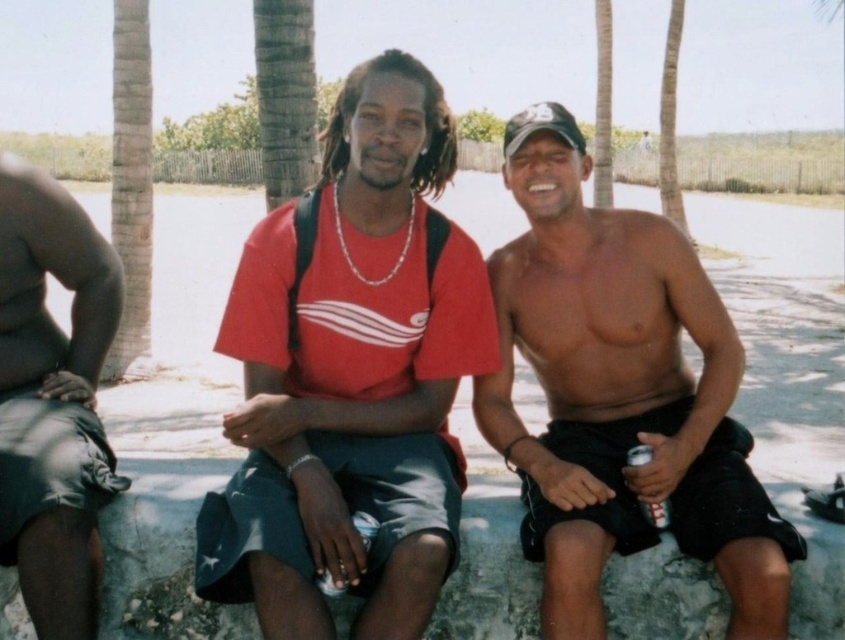
Consider the image. You are designing a digital collage and need to place a sticker exactly where the red matte shirt at center is located. According to the coordinates provided, what are the X and Y values you should use for the sticker placement?

The X value is 0.591 and the Y value is 0.417.

You are a photographer trying to capture the perfect shot of the shiny black shorts at center. According to the coordinates provided, where exactly should you position your camera to ensure the shorts are centered in your frame?

The shiny black shorts at center are located at coordinates point (620, 396), so you should position your camera to center the frame at those coordinates to capture the shorts perfectly.